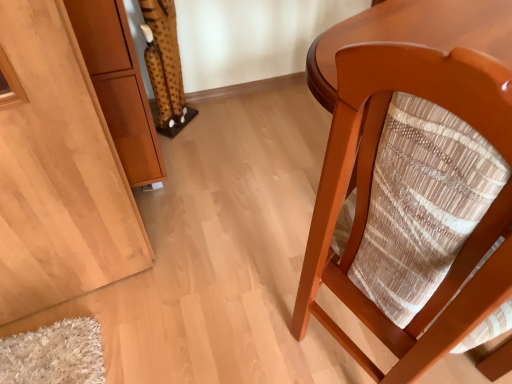
Locate an element on the screen. Image resolution: width=512 pixels, height=384 pixels. vacant space positioned to the left of wooden woven chair at right is located at coordinates (244, 301).